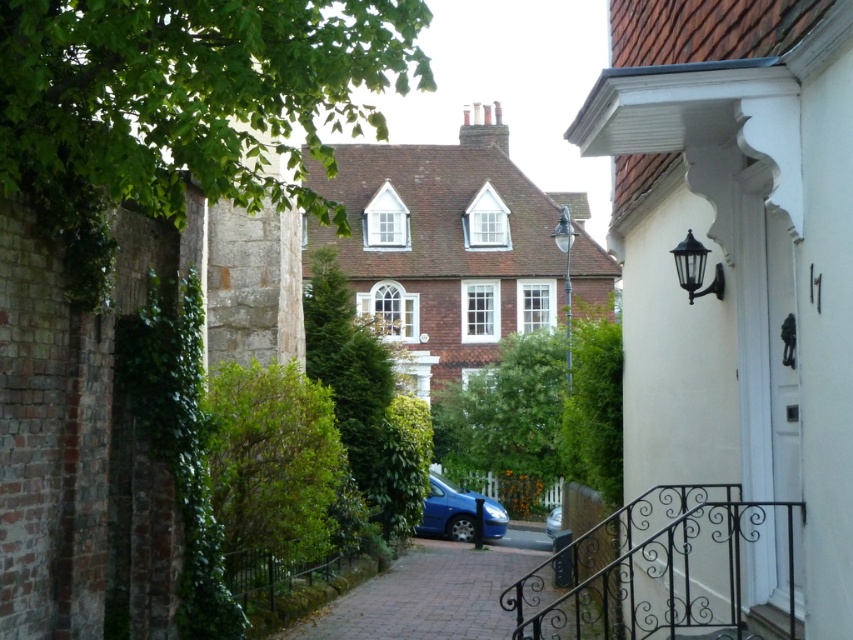
Question: Where is brick paved driveway at center located in relation to metallic blue car at center in the image?

Choices:
 (A) left
 (B) right

Answer: (A)

Question: Which object is farther from the camera taking this photo?

Choices:
 (A) brick paved driveway at center
 (B) blue metallic car at center
 (C) metallic blue car at center

Answer: (C)

Question: Among these objects, which one is nearest to the camera?

Choices:
 (A) blue metallic car at center
 (B) metallic blue car at center

Answer: (A)

Question: Does blue metallic car at center have a larger size compared to metallic blue car at center?

Choices:
 (A) no
 (B) yes

Answer: (A)

Question: Among these points, which one is nearest to the camera?

Choices:
 (A) (489, 582)
 (B) (556, 513)

Answer: (A)

Question: Does blue metallic car at center have a larger size compared to metallic blue car at center?

Choices:
 (A) yes
 (B) no

Answer: (B)